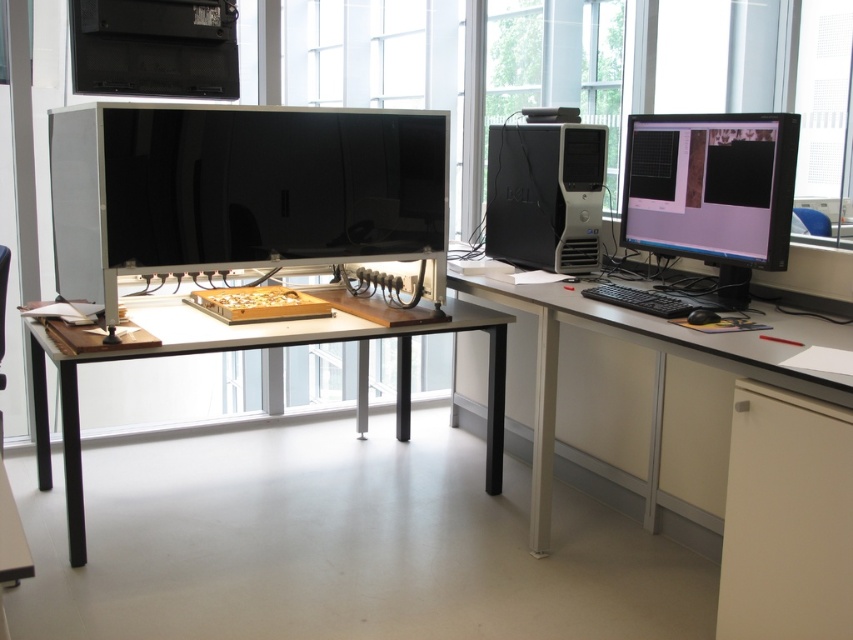
Does point (93, 273) lie in front of point (595, 252)?

Yes, it is in front of point (595, 252).

Is point (142, 228) more distant than point (491, 225)?

No, it is in front of (491, 225).

Locate an element on the screen. This screenshot has height=640, width=853. matte black monitor at center is located at coordinates (239, 189).

Is white glossy table at center bigger than black matte keyboard at right?

Yes, white glossy table at center is bigger than black matte keyboard at right.

Find the location of a particular element. This screenshot has height=640, width=853. white glossy table at center is located at coordinates (717, 451).

In the scene shown: Who is positioned more to the left, matte black monitor at right or black plastic computer tower at center-right?

From the viewer's perspective, black plastic computer tower at center-right appears more on the left side.

Is matte black monitor at right above black plastic computer tower at center-right?

No, matte black monitor at right is not above black plastic computer tower at center-right.

Image resolution: width=853 pixels, height=640 pixels. What do you see at coordinates (711, 186) in the screenshot? I see `matte black monitor at right` at bounding box center [711, 186].

At what (x,y) coordinates should I click in order to perform the action: click on matte black monitor at right. Please return your answer as a coordinate pair (x, y). Looking at the image, I should click on (711, 186).